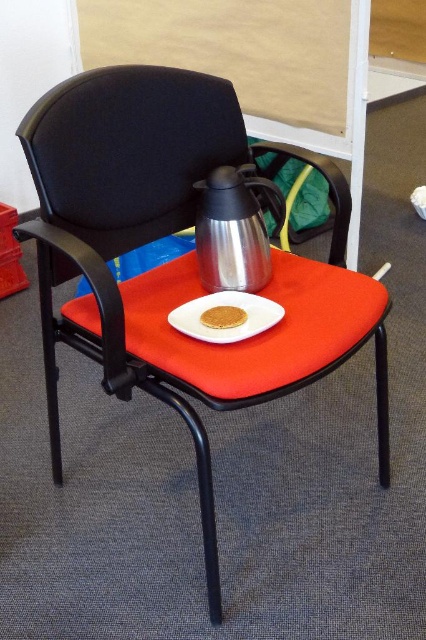
Does white matte plate at center have a greater height compared to golden crumbly cookie at center?

Indeed, white matte plate at center has a greater height compared to golden crumbly cookie at center.

Between white matte plate at center and golden crumbly cookie at center, which one is positioned higher?

white matte plate at center

Describe the element at coordinates (226, 316) in the screenshot. The width and height of the screenshot is (426, 640). I see `white matte plate at center` at that location.

Find the location of a particular element. Image resolution: width=426 pixels, height=640 pixels. white matte plate at center is located at coordinates (226, 316).

Can you confirm if metallic silver thermos at center is bigger than golden crumbly cookie at center?

Correct, metallic silver thermos at center is larger in size than golden crumbly cookie at center.

Who is lower down, metallic silver thermos at center or golden crumbly cookie at center?

Positioned lower is metallic silver thermos at center.

The width and height of the screenshot is (426, 640). Find the location of `metallic silver thermos at center`. metallic silver thermos at center is located at coordinates (261, 336).

Does metallic silver thermos at center appear on the right side of shiny metallic thermos at center?

Yes, metallic silver thermos at center is to the right of shiny metallic thermos at center.

Can you confirm if metallic silver thermos at center is wider than shiny metallic thermos at center?

Correct, the width of metallic silver thermos at center exceeds that of shiny metallic thermos at center.

Which is in front, point (382, 480) or point (230, 272)?

Positioned in front is point (230, 272).

Find the location of `metallic silver thermos at center`. metallic silver thermos at center is located at coordinates (261, 336).